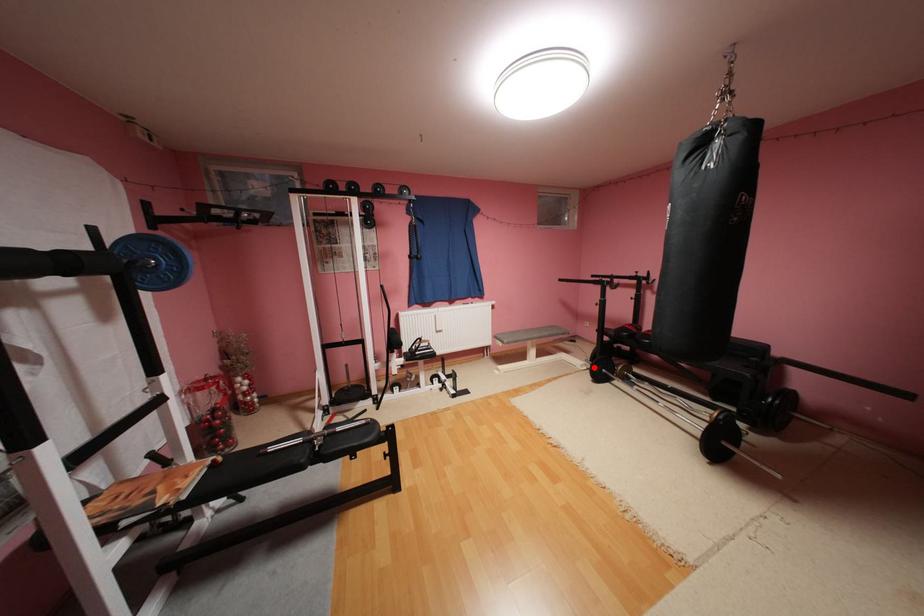
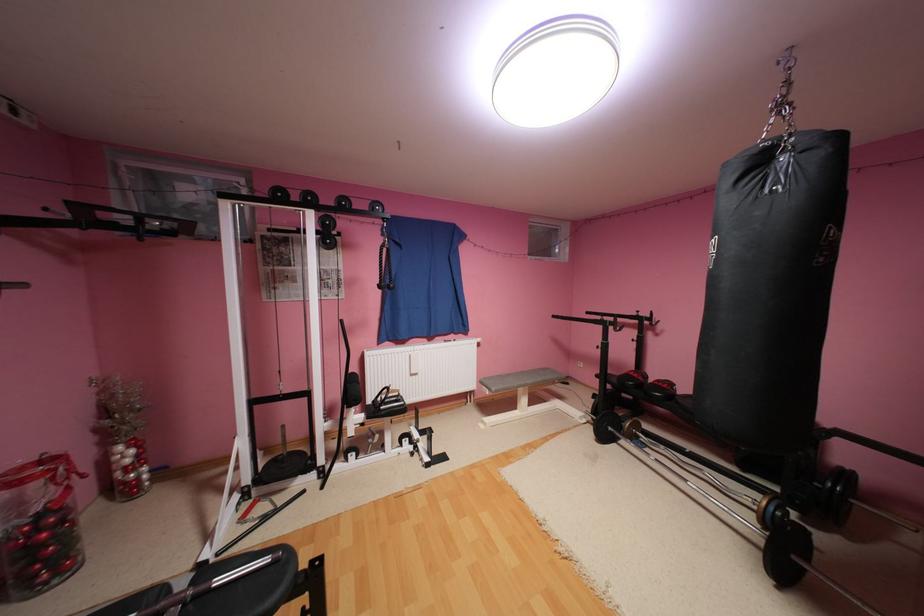
Question: I am providing you with two images of the same scene from different viewpoints. A red point is marked on the first image. Is the red point's position out of view in image 2?

Choices:
 (A) Yes
 (B) No

Answer: (B)